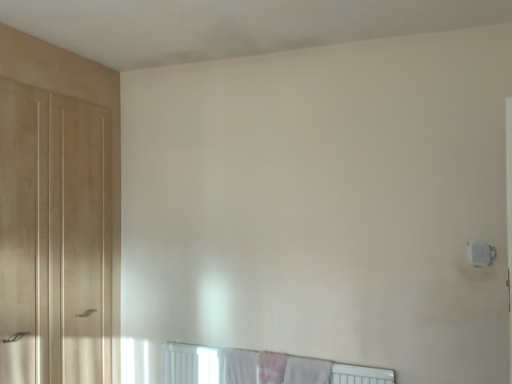
Describe the element at coordinates (54, 237) in the screenshot. I see `matte wood door at left` at that location.

This screenshot has height=384, width=512. Find the location of `matte wood door at left`. matte wood door at left is located at coordinates (54, 237).

Identify the location of matte wood door at left. (54, 237).